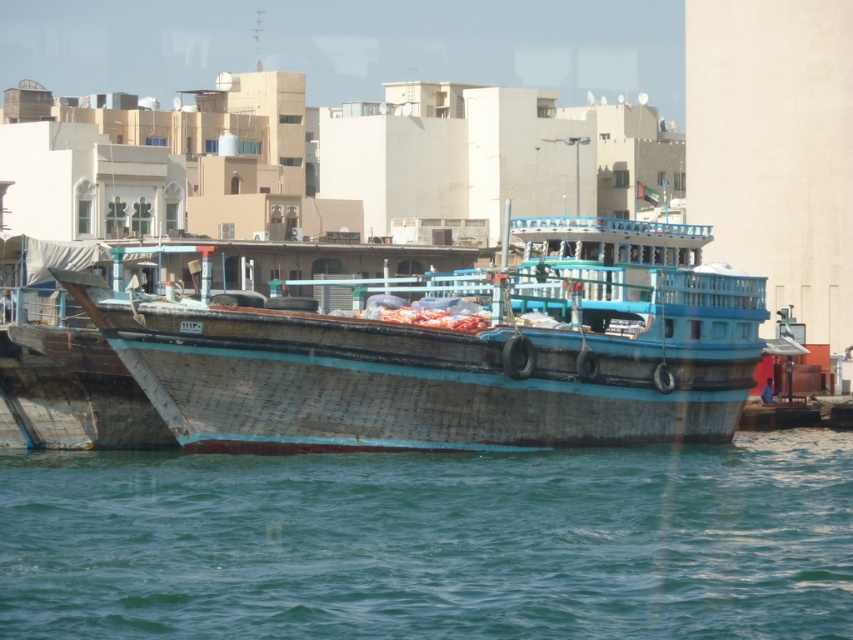
Is teal matte water at lower center bigger than wooden boat at center?

Incorrect, teal matte water at lower center is not larger than wooden boat at center.

From the picture: Who is taller, teal matte water at lower center or wooden boat at center?

wooden boat at center is taller.

Is point (212, 534) farther from camera compared to point (579, 365)?

No, (212, 534) is closer to viewer.

At what (x,y) coordinates should I click in order to perform the action: click on teal matte water at lower center. Please return your answer as a coordinate pair (x, y). This screenshot has height=640, width=853. Looking at the image, I should click on (432, 541).